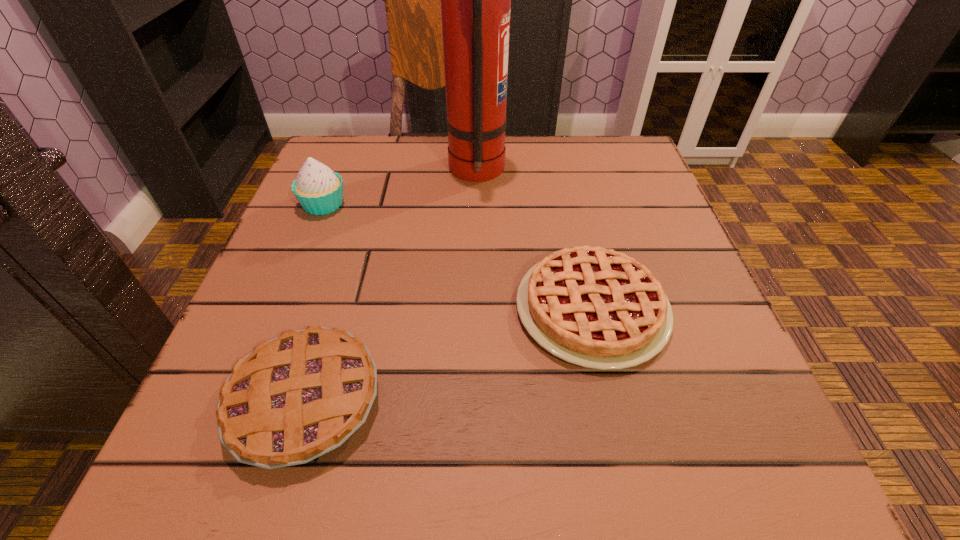
Locate an element on the screen. Image resolution: width=960 pixels, height=540 pixels. free space between the second tallest object and the right pie is located at coordinates (458, 256).

I want to click on free space that is in between the left pie and the tallest object, so click(x=391, y=286).

Where is `vacant space that is in between the fire extinguisher and the second tallest object`? vacant space that is in between the fire extinguisher and the second tallest object is located at coordinates (400, 187).

The image size is (960, 540). Identify the location of vacant point located between the third object from left to right and the second tallest object. (400, 187).

Where is `object that is the closest to the left pie`? object that is the closest to the left pie is located at coordinates (594, 307).

Image resolution: width=960 pixels, height=540 pixels. Find the location of `the closest object to the cupcake`. the closest object to the cupcake is located at coordinates (475, 0).

Where is `free space that satisfies the following two spatial constraints: 1. on the label side of the second object from right to left; 2. on the back side of the right pie`? Image resolution: width=960 pixels, height=540 pixels. free space that satisfies the following two spatial constraints: 1. on the label side of the second object from right to left; 2. on the back side of the right pie is located at coordinates (475, 309).

In order to click on vacant space that satisfies the following two spatial constraints: 1. on the label side of the fire extinguisher; 2. on the left side of the right pie in this screenshot , I will do `click(475, 309)`.

Where is `vacant space that satisfies the following two spatial constraints: 1. on the front side of the left pie; 2. on the right side of the second tallest object`? Image resolution: width=960 pixels, height=540 pixels. vacant space that satisfies the following two spatial constraints: 1. on the front side of the left pie; 2. on the right side of the second tallest object is located at coordinates (244, 400).

Where is `vacant position in the image that satisfies the following two spatial constraints: 1. on the front side of the left pie; 2. on the left side of the cupcake`? The height and width of the screenshot is (540, 960). vacant position in the image that satisfies the following two spatial constraints: 1. on the front side of the left pie; 2. on the left side of the cupcake is located at coordinates (244, 400).